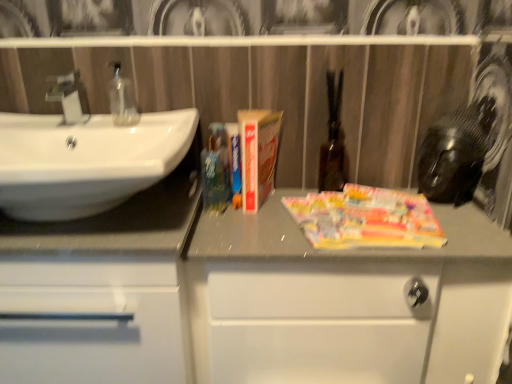
Measure the distance between point (x=117, y=297) and camera.

They are 33.98 inches apart.

Looking at this image, measure the distance between white glossy sink at left and camera.

They are 29.36 inches apart.

Measure the distance between transparent glass soap at left and camera.

transparent glass soap at left is 1.08 meters away from camera.

Where is `white matte cabinet at center, the 2th bathroom cabinet in the left-to-right sequence`? This screenshot has height=384, width=512. white matte cabinet at center, the 2th bathroom cabinet in the left-to-right sequence is located at coordinates (248, 299).

Which is further, (153,138) or (45,95)?

The point (45,95) is more distant.

From a real-world perspective, is white glossy sink at left on matte silver faucet at left?

Actually, white glossy sink at left is physically below matte silver faucet at left in the real world.

Considering the sizes of objects white glossy sink at left and matte silver faucet at left in the image provided, who is taller, white glossy sink at left or matte silver faucet at left?

Standing taller between the two is white glossy sink at left.

Is white glossy sink at left touching matte silver faucet at left?

No, white glossy sink at left is not beside matte silver faucet at left.

Who is shorter, hardcover book at center or white matte cabinet at center, the first bathroom cabinet positioned from the right?

hardcover book at center.

Are hardcover book at center and white matte cabinet at center, the first bathroom cabinet positioned from the right, making contact?

No, hardcover book at center is not with white matte cabinet at center, the first bathroom cabinet positioned from the right.

Is hardcover book at center aimed at white matte cabinet at center, the first bathroom cabinet positioned from the right?

No.

In the scene shown: From a real-world perspective, is hardcover book at center positioned above or below white matte cabinet at center, the first bathroom cabinet positioned from the right?

Clearly, from a real-world perspective, hardcover book at center is above white matte cabinet at center, the first bathroom cabinet positioned from the right.

Is white glossy cabinet at left, the second bathroom cabinet when ordered from right to left, to the right of white matte cabinet at center, the first bathroom cabinet positioned from the right, from the viewer's perspective?

Incorrect, white glossy cabinet at left, the second bathroom cabinet when ordered from right to left, is not on the right side of white matte cabinet at center, the first bathroom cabinet positioned from the right.

Can we say white glossy cabinet at left, the second bathroom cabinet when ordered from right to left, lies outside white matte cabinet at center, the 2th bathroom cabinet in the left-to-right sequence?

white glossy cabinet at left, the second bathroom cabinet when ordered from right to left, lies outside white matte cabinet at center, the 2th bathroom cabinet in the left-to-right sequence,'s area.

Is point (156, 327) closer or farther from the camera than point (353, 355)?

Point (156, 327) is positioned closer to the camera compared to point (353, 355).

In order to click on bathroom cabinet on the left of white matte cabinet at center, the first bathroom cabinet positioned from the right in this screenshot , I will do `click(94, 321)`.

Looking at this image, can you confirm if matte silver faucet at left is smaller than white glossy sink at left?

Correct, matte silver faucet at left occupies less space than white glossy sink at left.

The height and width of the screenshot is (384, 512). Find the location of `sink below the matte silver faucet at left (from a real-world perspective)`. sink below the matte silver faucet at left (from a real-world perspective) is located at coordinates (85, 160).

Is matte silver faucet at left positioned beyond the bounds of white glossy sink at left?

Absolutely, matte silver faucet at left is external to white glossy sink at left.

Which of these two, white matte cabinet at center, the 2th bathroom cabinet in the left-to-right sequence, or transparent glass soap at left, stands shorter?

transparent glass soap at left is shorter.

Can you confirm if white matte cabinet at center, the first bathroom cabinet positioned from the right, is wider than transparent glass soap at left?

Yes.

Looking at this image, from the image's perspective, is white matte cabinet at center, the first bathroom cabinet positioned from the right, located above or below transparent glass soap at left?

white matte cabinet at center, the first bathroom cabinet positioned from the right, is below transparent glass soap at left.

Can you confirm if white matte cabinet at center, the first bathroom cabinet positioned from the right, is positioned to the left of white glossy cabinet at left, the second bathroom cabinet when ordered from right to left?

No, white matte cabinet at center, the first bathroom cabinet positioned from the right, is not to the left of white glossy cabinet at left, the second bathroom cabinet when ordered from right to left.

This screenshot has width=512, height=384. In order to click on bathroom cabinet on the left of white matte cabinet at center, the 2th bathroom cabinet in the left-to-right sequence in this screenshot , I will do `click(94, 321)`.

Is point (369, 295) positioned behind point (89, 259)?

That is True.

Is white matte cabinet at center, the 2th bathroom cabinet in the left-to-right sequence, closer to camera compared to white glossy cabinet at left, which appears as the 1th bathroom cabinet when viewed from the left?

No.

Are matte silver faucet at left and white matte cabinet at center, the 2th bathroom cabinet in the left-to-right sequence, making contact?

matte silver faucet at left and white matte cabinet at center, the 2th bathroom cabinet in the left-to-right sequence, are clearly separated.

Which object is wider, matte silver faucet at left or white matte cabinet at center, the 2th bathroom cabinet in the left-to-right sequence?

With larger width is white matte cabinet at center, the 2th bathroom cabinet in the left-to-right sequence.

What's the angular difference between matte silver faucet at left and white matte cabinet at center, the first bathroom cabinet positioned from the right,'s facing directions?

matte silver faucet at left and white matte cabinet at center, the first bathroom cabinet positioned from the right, are facing 0.572 degrees away from each other.

From their relative heights in the image, would you say matte silver faucet at left is taller or shorter than white matte cabinet at center, the 2th bathroom cabinet in the left-to-right sequence?

In the image, matte silver faucet at left appears to be shorter than white matte cabinet at center, the 2th bathroom cabinet in the left-to-right sequence.

I want to click on sink located in front of the matte silver faucet at left, so click(85, 160).

Where is `paperback book behind the white matte cabinet at center, the first bathroom cabinet positioned from the right`? This screenshot has height=384, width=512. paperback book behind the white matte cabinet at center, the first bathroom cabinet positioned from the right is located at coordinates (258, 155).

From the picture: When comparing their distances from white glossy sink at left, does hardcover book at center or transparent glass soap at left seem closer?

transparent glass soap at left is closer to white glossy sink at left.

Considering their positions, is hardcover book at center positioned closer to white glossy cabinet at left, the second bathroom cabinet when ordered from right to left, than white glossy sink at left?

The object closer to white glossy cabinet at left, the second bathroom cabinet when ordered from right to left, is white glossy sink at left.

Considering their positions, is white matte cabinet at center, the 2th bathroom cabinet in the left-to-right sequence, positioned further to white glossy cabinet at left, the second bathroom cabinet when ordered from right to left, than hardcover book at center?

hardcover book at center is further to white glossy cabinet at left, the second bathroom cabinet when ordered from right to left.

Looking at the image, which one is located closer to white glossy cabinet at left, the second bathroom cabinet when ordered from right to left, white glossy sink at left or matte silver faucet at left?

Among the two, white glossy sink at left is located nearer to white glossy cabinet at left, the second bathroom cabinet when ordered from right to left.

Which object lies further to the anchor point hardcover book at center, white glossy cabinet at left, which appears as the 1th bathroom cabinet when viewed from the left, or transparent glass soap at left?

The object further to hardcover book at center is white glossy cabinet at left, which appears as the 1th bathroom cabinet when viewed from the left.

From the image, which object appears to be farther from white matte cabinet at center, the first bathroom cabinet positioned from the right, white glossy cabinet at left, which appears as the 1th bathroom cabinet when viewed from the left, or transparent glass soap at left?

The object further to white matte cabinet at center, the first bathroom cabinet positioned from the right, is transparent glass soap at left.

When comparing their distances from white matte cabinet at center, the 2th bathroom cabinet in the left-to-right sequence, does matte silver faucet at left or transparent glass soap at left seem further?

Among the two, matte silver faucet at left is located further to white matte cabinet at center, the 2th bathroom cabinet in the left-to-right sequence.

From the image, which object appears to be farther from white glossy sink at left, hardcover book at center or white glossy cabinet at left, which appears as the 1th bathroom cabinet when viewed from the left?

hardcover book at center is further to white glossy sink at left.

This screenshot has height=384, width=512. What are the coordinates of `tap between transparent glass soap at left and white glossy cabinet at left, which appears as the 1th bathroom cabinet when viewed from the left, vertically` in the screenshot? It's located at click(x=67, y=96).

In order to click on soap between matte silver faucet at left and white matte cabinet at center, the first bathroom cabinet positioned from the right, in the horizontal direction in this screenshot , I will do `click(122, 98)`.

At what (x,y) coordinates should I click in order to perform the action: click on paperback book that lies between transparent glass soap at left and white matte cabinet at center, the first bathroom cabinet positioned from the right, from top to bottom. Please return your answer as a coordinate pair (x, y). This screenshot has height=384, width=512. Looking at the image, I should click on (258, 155).

This screenshot has height=384, width=512. Find the location of `tap between white glossy sink at left and transparent glass soap at left along the z-axis`. tap between white glossy sink at left and transparent glass soap at left along the z-axis is located at coordinates (67, 96).